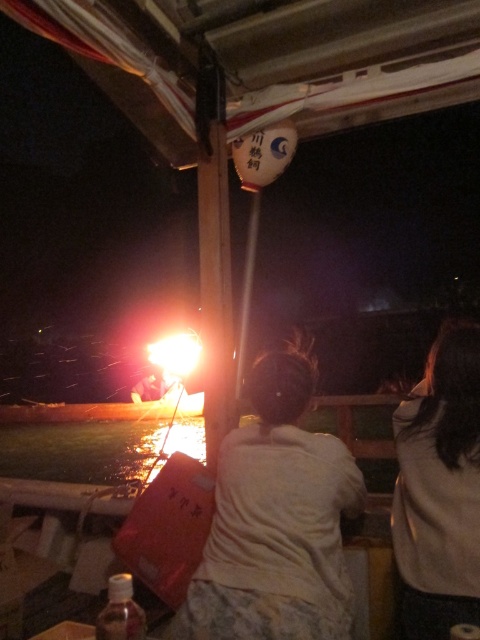
Image resolution: width=480 pixels, height=640 pixels. I want to click on white cotton shirt at center, so click(276, 520).

The height and width of the screenshot is (640, 480). I want to click on white cotton shirt at center, so click(x=276, y=520).